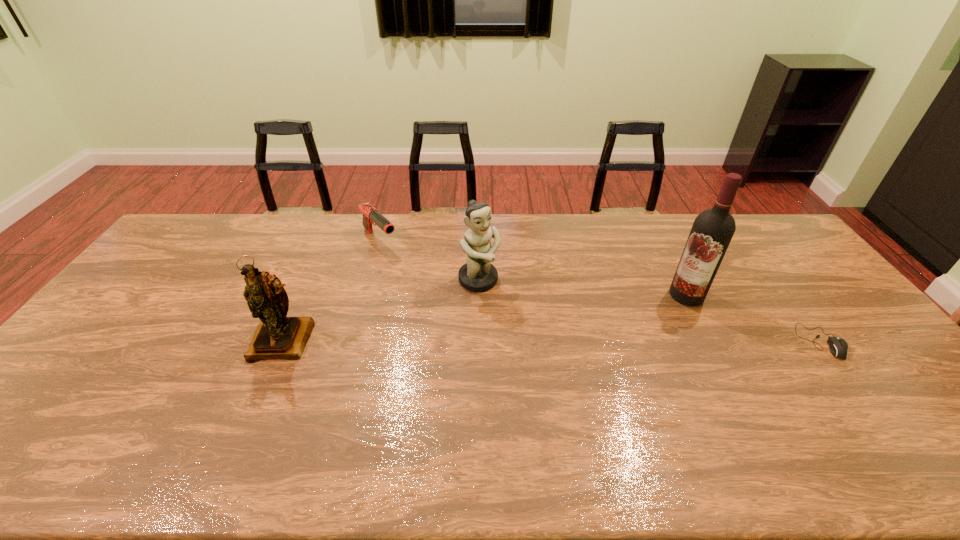
This screenshot has width=960, height=540. I want to click on empty location between the leftmost object and the second shortest object, so click(x=332, y=291).

Where is `vacant area that lies between the tallest object and the third object from left to right`? vacant area that lies between the tallest object and the third object from left to right is located at coordinates (583, 288).

This screenshot has height=540, width=960. What are the coordinates of `free space between the farther figurine and the wine bottle` in the screenshot? It's located at (583, 288).

Locate an element on the screen. This screenshot has height=540, width=960. vacant space in between the gun and the farther figurine is located at coordinates (429, 260).

At what (x,y) coordinates should I click in order to perform the action: click on vacant area that lies between the computer mouse and the gun. Please return your answer as a coordinate pair (x, y). The width and height of the screenshot is (960, 540). Looking at the image, I should click on (600, 291).

This screenshot has width=960, height=540. What are the coordinates of `vacant area that lies between the wine bottle and the leftmost object` in the screenshot? It's located at [x=485, y=318].

Image resolution: width=960 pixels, height=540 pixels. In order to click on vacant point located between the leftmost object and the fourth object from right to left in this screenshot , I will do `click(332, 291)`.

Locate an element on the screen. The height and width of the screenshot is (540, 960). object that is the closest to the farthest object is located at coordinates pyautogui.click(x=478, y=275).

Select which object is the fourth closest to the fourth object from left to right. Please provide its 2D coordinates. Your answer should be formatted as a tuple, i.e. [(x, y)], where the tuple contains the x and y coordinates of a point satisfying the conditions above.

[(277, 336)]

Where is `vacant space that satisfies the following two spatial constraints: 1. on the front side of the gun; 2. on the right side of the third object from left to right`? This screenshot has height=540, width=960. vacant space that satisfies the following two spatial constraints: 1. on the front side of the gun; 2. on the right side of the third object from left to right is located at coordinates (369, 280).